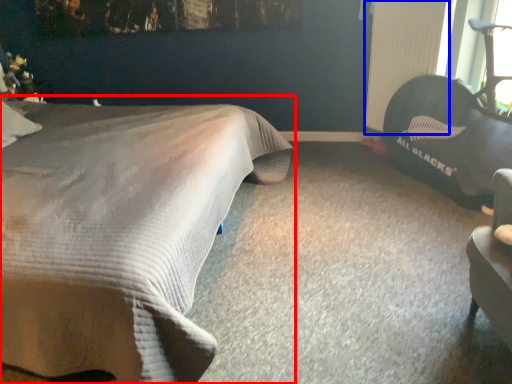
Question: Among these objects, which one is farthest to the camera, bed (highlighted by a red box) or radiator (highlighted by a blue box)?

Choices:
 (A) bed
 (B) radiator

Answer: (B)